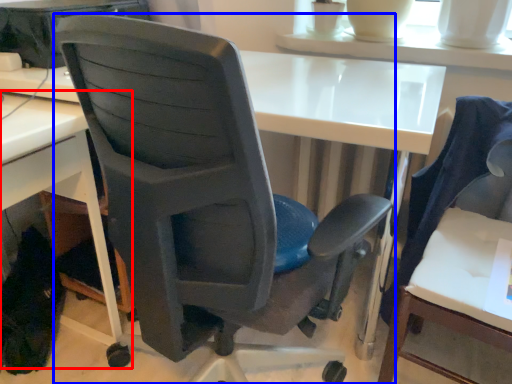
Question: Which object is closer to the camera taking this photo, desk (highlighted by a red box) or chair (highlighted by a blue box)?

Choices:
 (A) desk
 (B) chair

Answer: (B)